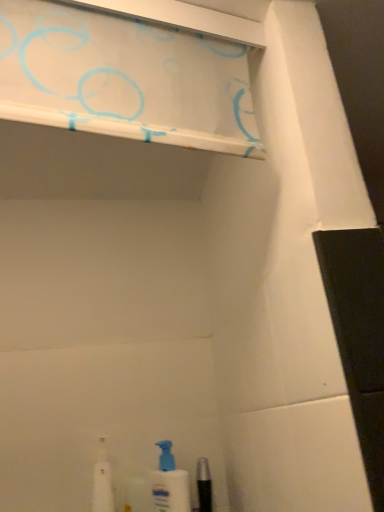
Identify the location of white plastic bottle at lower left. (102, 481).

Image resolution: width=384 pixels, height=512 pixels. What are the coordinates of `toiletry lying behind the white glossy shelf at upper center` in the screenshot? It's located at (102, 481).

Between white plastic bottle at lower left and white glossy shelf at upper center, which one appears on the right side from the viewer's perspective?

white glossy shelf at upper center is more to the right.

From the image's perspective, would you say white plastic bottle at lower left is positioned over white glossy shelf at upper center?

No.

Is the position of white plastic bottle at lower left more distant than that of white plastic spray bottle at lower center?

No.

From a real-world perspective, who is located lower, white plastic bottle at lower left or white plastic spray bottle at lower center?

From a 3D spatial view, white plastic spray bottle at lower center is below.

Which is closer, [93,493] or [185,480]?

Point [185,480]

Is white plastic spray bottle at lower center turned away from white plastic bottle at lower left?

No.

In the scene shown: Is white plastic spray bottle at lower center not inside white plastic bottle at lower left?

Yes, white plastic spray bottle at lower center is not within white plastic bottle at lower left.

From a real-world perspective, between white plastic spray bottle at lower center and white plastic bottle at lower left, who is vertically lower?

white plastic spray bottle at lower center, from a real-world perspective.

Measure the distance from white plastic spray bottle at lower center to white plastic bottle at lower left.

white plastic spray bottle at lower center and white plastic bottle at lower left are 12.79 centimeters apart from each other.

Is point (167, 448) in front of point (62, 17)?

No, it is behind (62, 17).

In the scene shown: Which object is closer to the camera taking this photo, white plastic spray bottle at lower center or white glossy shelf at upper center?

white glossy shelf at upper center.

Who is bigger, white plastic spray bottle at lower center or white glossy shelf at upper center?

With larger size is white glossy shelf at upper center.

Which of these two, white plastic spray bottle at lower center or white glossy shelf at upper center, stands taller?

With more height is white plastic spray bottle at lower center.

Is point (154, 99) closer to viewer compared to point (104, 452)?

Yes, point (154, 99) is in front of point (104, 452).

Would you consider white glossy shelf at upper center to be distant from white plastic bottle at lower left?

That's not correct — white glossy shelf at upper center is a little close to white plastic bottle at lower left.

From a real-world perspective, is white glossy shelf at upper center positioned above or below white plastic bottle at lower left?

Clearly, from a real-world perspective, white glossy shelf at upper center is above white plastic bottle at lower left.

In the scene shown: From the image's perspective, would you say white glossy shelf at upper center is positioned over white plastic bottle at lower left?

Yes.

Is white glossy shelf at upper center in front of or behind white plastic spray bottle at lower center in the image?

In the image, white glossy shelf at upper center appears in front of white plastic spray bottle at lower center.

From a real-world perspective, who is located lower, white glossy shelf at upper center or white plastic spray bottle at lower center?

white plastic spray bottle at lower center.

Considering the positions of point (242, 137) and point (182, 489), is point (242, 137) closer or farther from the camera than point (182, 489)?

Clearly, point (242, 137) is closer to the camera than point (182, 489).

Is white glossy shelf at upper center taller than white plastic spray bottle at lower center?

No.

Locate an element on the screen. The height and width of the screenshot is (512, 384). toiletry below the white glossy shelf at upper center (from the image's perspective) is located at coordinates (102, 481).

The height and width of the screenshot is (512, 384). I want to click on toiletry to the left of white plastic spray bottle at lower center, so click(102, 481).

When comparing their distances from white plastic spray bottle at lower center, does white plastic bottle at lower left or white glossy shelf at upper center seem further?

white glossy shelf at upper center is positioned further to the anchor white plastic spray bottle at lower center.

Based on their spatial positions, is white plastic spray bottle at lower center or white glossy shelf at upper center closer to white plastic bottle at lower left?

Based on the image, white plastic spray bottle at lower center appears to be nearer to white plastic bottle at lower left.

Which object lies nearer to the anchor point white glossy shelf at upper center, white plastic spray bottle at lower center or white plastic bottle at lower left?

Among the two, white plastic spray bottle at lower center is located nearer to white glossy shelf at upper center.

Consider the image. Estimate the real-world distances between objects in this image. Which object is further from white plastic bottle at lower left, white glossy shelf at upper center or white plastic spray bottle at lower center?

The object further to white plastic bottle at lower left is white glossy shelf at upper center.

Based on their spatial positions, is white plastic bottle at lower left or white plastic spray bottle at lower center further from white glossy shelf at upper center?

white plastic bottle at lower left is further to white glossy shelf at upper center.

Which object lies nearer to the anchor point white plastic spray bottle at lower center, white glossy shelf at upper center or white plastic bottle at lower left?

white plastic bottle at lower left is closer to white plastic spray bottle at lower center.

I want to click on toiletry between white glossy shelf at upper center and white plastic spray bottle at lower center vertically, so click(x=102, y=481).